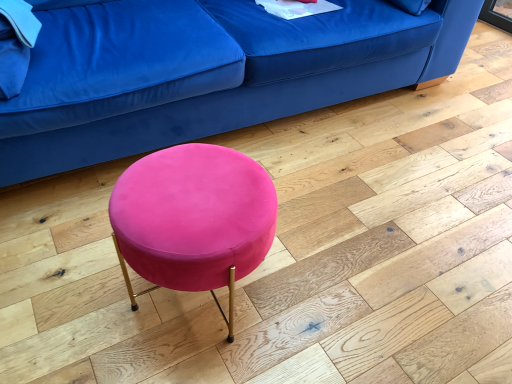
Question: In terms of width, does velvet blue couch at upper center look wider or thinner when compared to velvet pink stool at center?

Choices:
 (A) wide
 (B) thin

Answer: (A)

Question: Which is correct: velvet blue couch at upper center is inside velvet pink stool at center, or outside of it?

Choices:
 (A) inside
 (B) outside

Answer: (B)

Question: Considering the positions of velvet blue couch at upper center and velvet pink stool at center in the image, is velvet blue couch at upper center bigger or smaller than velvet pink stool at center?

Choices:
 (A) big
 (B) small

Answer: (A)

Question: Is velvet pink stool at center situated inside velvet blue couch at upper center or outside?

Choices:
 (A) outside
 (B) inside

Answer: (A)

Question: From the image's perspective, is velvet pink stool at center located above or below velvet blue couch at upper center?

Choices:
 (A) above
 (B) below

Answer: (B)

Question: Based on their positions, is velvet pink stool at center located to the left or right of velvet blue couch at upper center?

Choices:
 (A) left
 (B) right

Answer: (A)

Question: Is velvet pink stool at center bigger or smaller than velvet blue couch at upper center?

Choices:
 (A) big
 (B) small

Answer: (B)